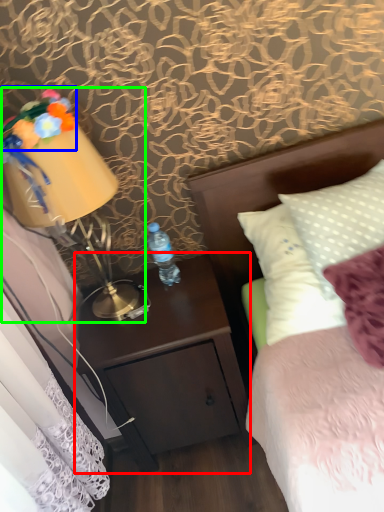
Question: Estimate the real-world distances between objects in this image. Which object is farther from nightstand (highlighted by a red box), flower (highlighted by a blue box) or bedside lamp (highlighted by a green box)?

Choices:
 (A) flower
 (B) bedside lamp

Answer: (A)